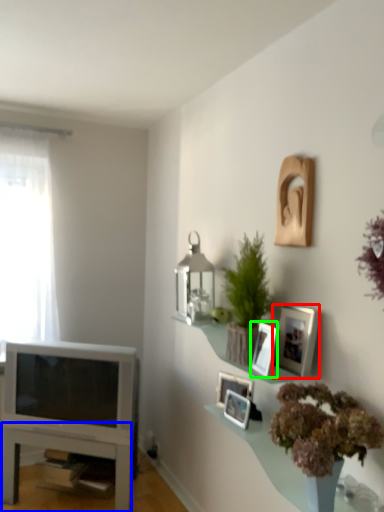
Question: Which object is the farthest from picture frame (highlighted by a red box)? Choose among these: table (highlighted by a blue box) or picture frame (highlighted by a green box).

Choices:
 (A) table
 (B) picture frame

Answer: (A)